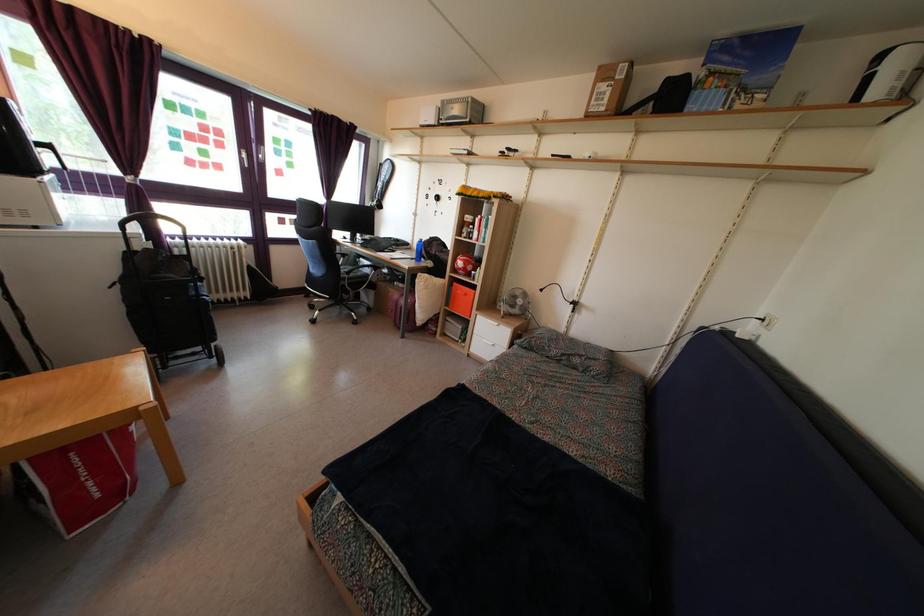
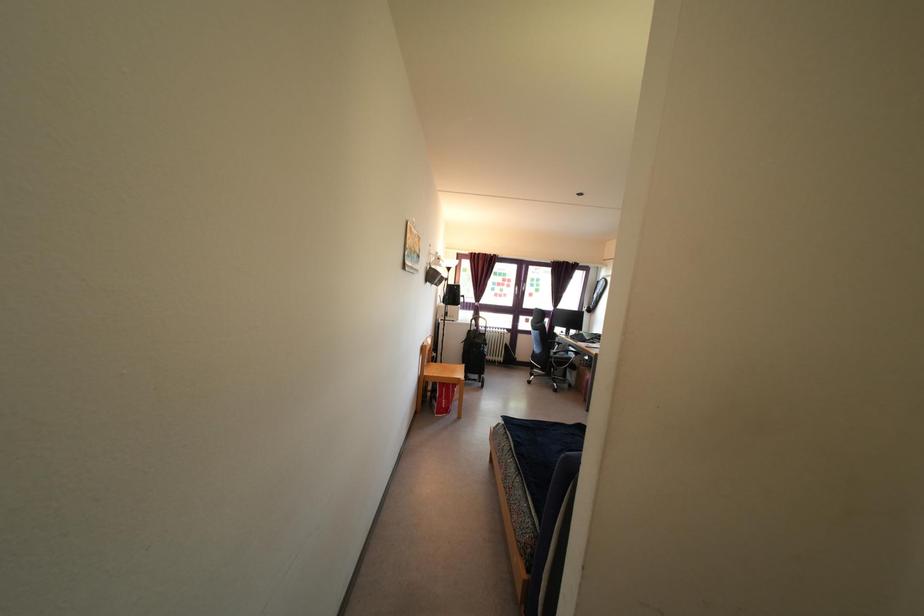
In the second image, find the point that corresponds to (x=350, y=243) in the first image.

(566, 338)